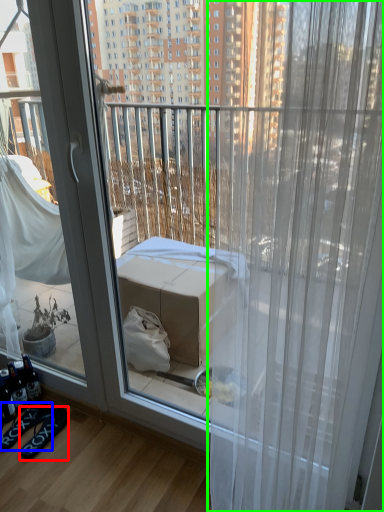
Question: Which object is the closest to the footwear (highlighted by a red box)? Choose among these: footwear (highlighted by a blue box) or curtain (highlighted by a green box).

Choices:
 (A) footwear
 (B) curtain

Answer: (A)